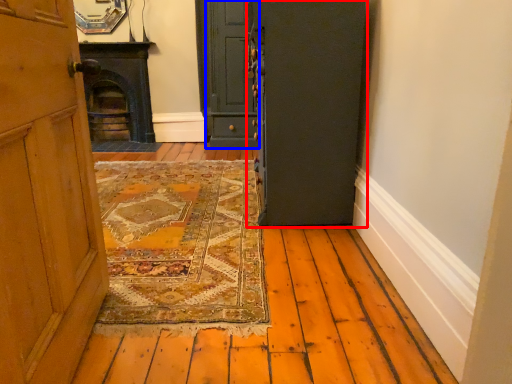
Question: Which point is further to the camera, door (highlighted by a red box) or door (highlighted by a blue box)?

Choices:
 (A) door
 (B) door

Answer: (B)